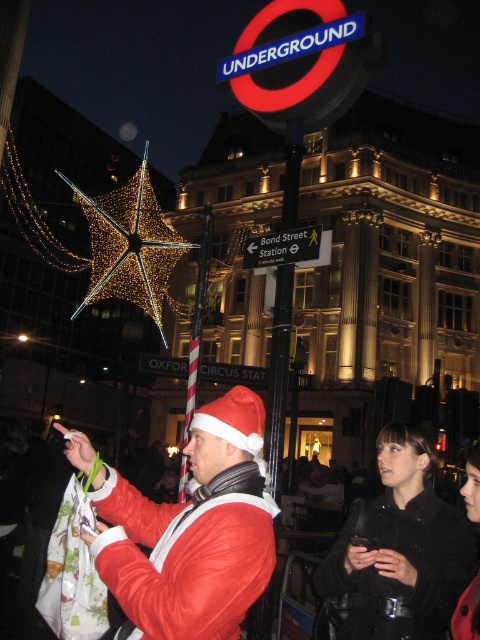
You are a photographer taking a picture of the black plastic sign at center and the matte red santa hat at center. Which object should you adjust your camera to focus on first if you want to capture both clearly in the same frame?

The matte red santa hat at center is positioned on the left side of black plastic sign at center, so you should focus on the black plastic sign at center first as it is further away to ensure both are in focus.

You are a photographer standing in the scene wanting to capture both the matte red santa hat at center and the black plastic sign at center in the same frame. Which object should you focus on first to ensure both are in focus?

You should focus on the matte red santa hat at center first because it is closer to the viewer than the black plastic sign at center, so focusing on the closer object will keep both in focus when using a shallow depth of field.